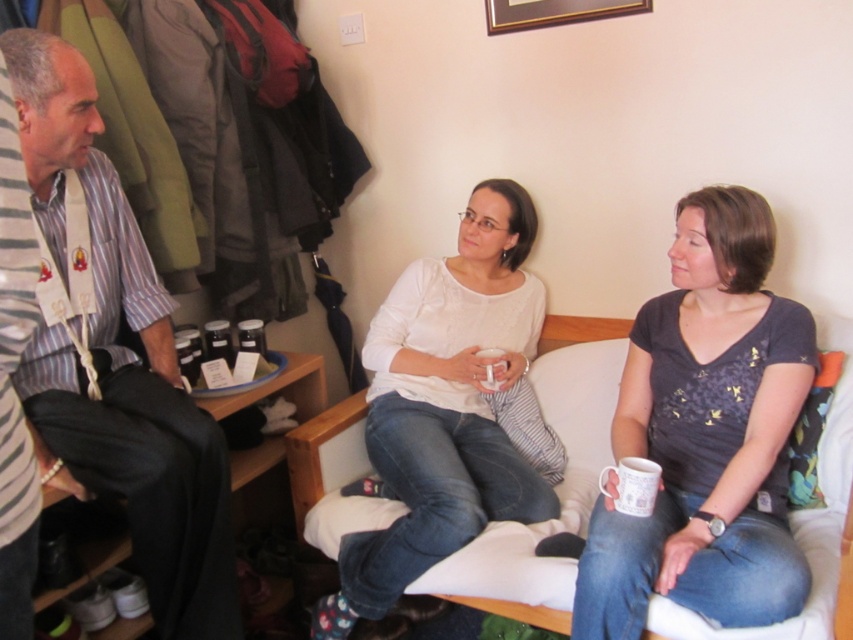
Is matte gray shirt at center positioned at the back of white matte shirt at center?

No.

Between matte gray shirt at center and white matte shirt at center, which one is positioned higher?

matte gray shirt at center is above.

Who is more forward, [618,586] or [466,340]?

Point [618,586] is more forward.

Locate an element on the screen. The image size is (853, 640). matte gray shirt at center is located at coordinates (706, 435).

Does white matte shirt at center appear on the left side of white fabric couch at center?

Indeed, white matte shirt at center is positioned on the left side of white fabric couch at center.

Who is higher up, white matte shirt at center or white fabric couch at center?

white matte shirt at center

Is point (454, 330) closer to viewer compared to point (538, 572)?

No, (454, 330) is behind (538, 572).

Identify the location of white matte shirt at center. The width and height of the screenshot is (853, 640). (445, 406).

Image resolution: width=853 pixels, height=640 pixels. I want to click on matte gray shirt at center, so click(x=706, y=435).

Which is behind, point (726, 285) or point (136, 284)?

The point (136, 284) is behind.

This screenshot has width=853, height=640. I want to click on matte gray shirt at center, so click(706, 435).